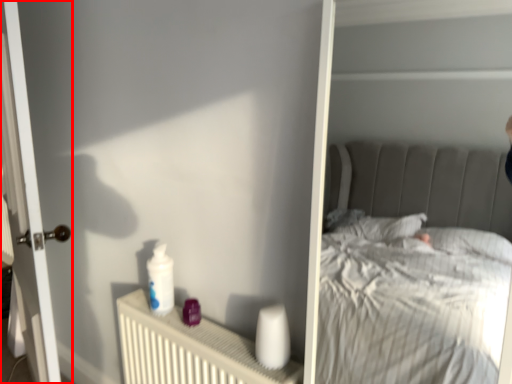
Question: From the image's perspective, what is the correct spatial positioning of door (annotated by the red box) in reference to radiator?

Choices:
 (A) below
 (B) above

Answer: (B)